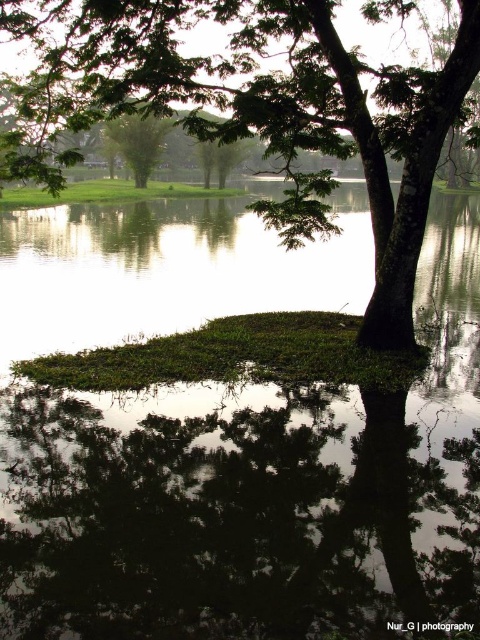
Question: Can you confirm if green leafy tree at center is smaller than green leafy tree at upper left?

Choices:
 (A) yes
 (B) no

Answer: (B)

Question: Which point is farther to the camera?

Choices:
 (A) green leafy tree at upper left
 (B) green leafy tree at center

Answer: (A)

Question: Which of the following is the closest to the observer?

Choices:
 (A) green leafy tree at center
 (B) green leafy tree at upper left

Answer: (A)

Question: Does green leafy tree at center appear over green leafy tree at upper left?

Choices:
 (A) no
 (B) yes

Answer: (A)

Question: Does green leafy tree at center have a larger size compared to green leafy tree at upper left?

Choices:
 (A) yes
 (B) no

Answer: (A)